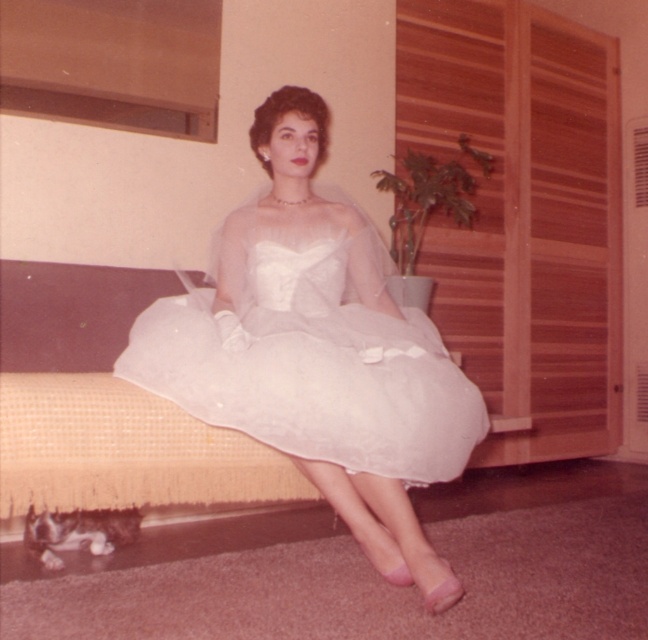
Which is more to the right, white satin dress at center or white sheer dress at center?

From the viewer's perspective, white sheer dress at center appears more on the right side.

Is point (290, 225) positioned before point (467, 419)?

No, (290, 225) is further to viewer.

Where is `white satin dress at center`? The height and width of the screenshot is (640, 648). white satin dress at center is located at coordinates (318, 353).